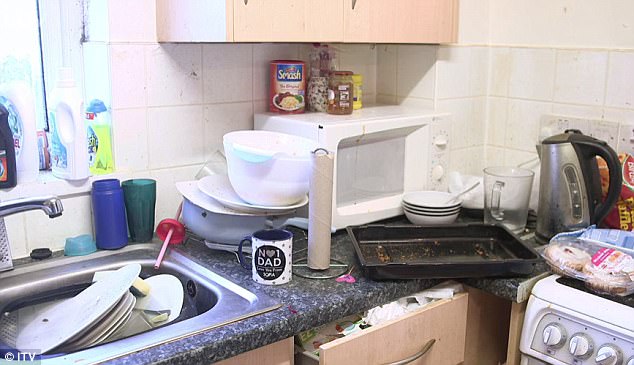
In order to click on stack of small bowls in this screenshot , I will do `click(428, 209)`.